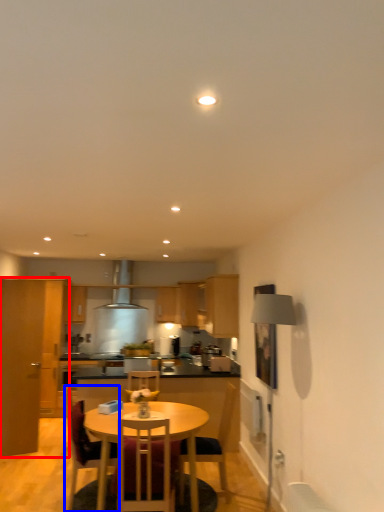
Question: Which point is closer to the camera, cabinetry (highlighted by a red box) or chair (highlighted by a blue box)?

Choices:
 (A) cabinetry
 (B) chair

Answer: (B)